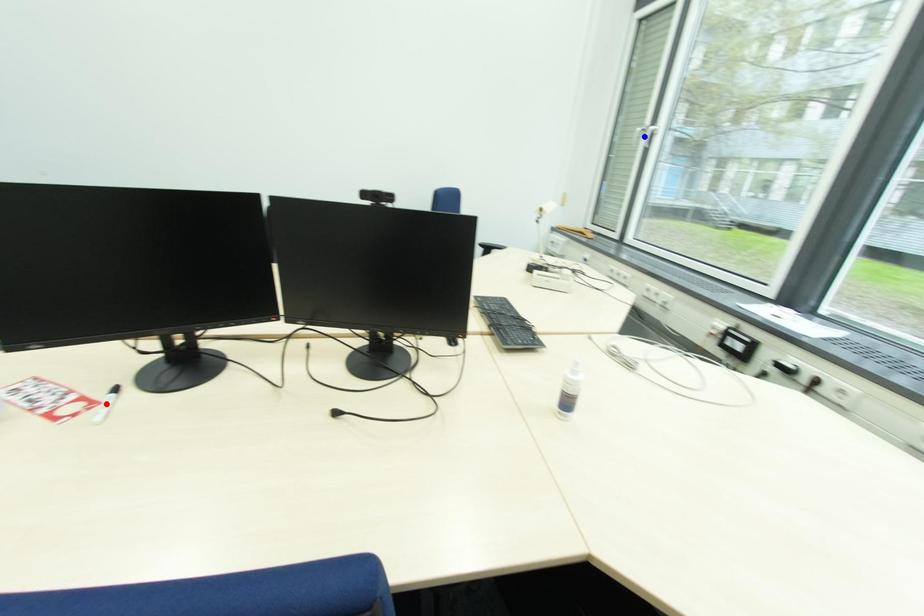
Question: Which of the two points in the image is closer to the camera?

Choices:
 (A) Blue point is closer.
 (B) Red point is closer.

Answer: (B)